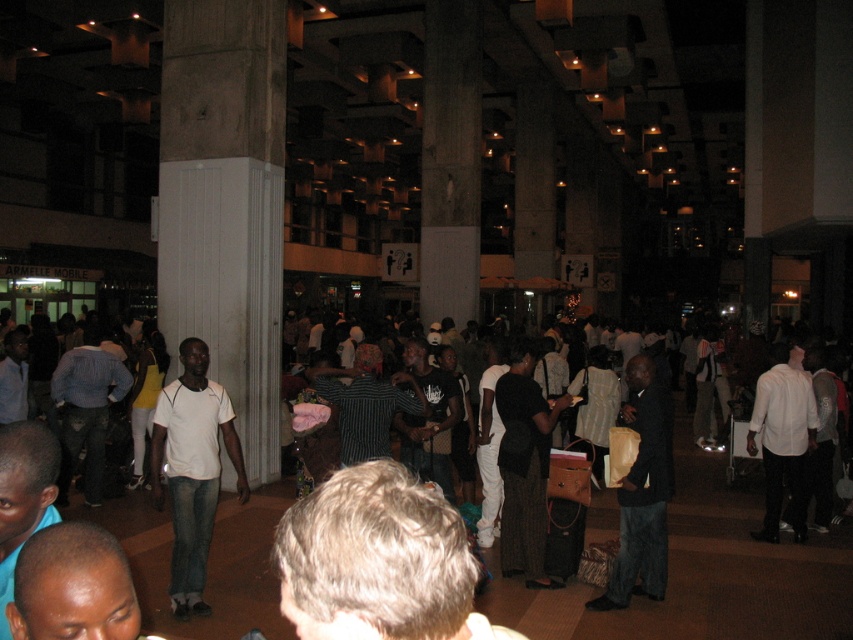
Between white matte t-shirt at center and dark brown leather jacket at center, which one appears on the left side from the viewer's perspective?

white matte t-shirt at center

Which of these two, white matte t-shirt at center or dark brown leather jacket at center, stands taller?

white matte t-shirt at center

Consider the image. Who is more forward, (225, 440) or (653, 532)?

Positioned in front is point (225, 440).

Locate an element on the screen. This screenshot has height=640, width=853. white matte t-shirt at center is located at coordinates (192, 468).

Can you confirm if dark brown leather jacket at center is positioned below white shirt at right?

Actually, dark brown leather jacket at center is above white shirt at right.

Can you confirm if dark brown leather jacket at center is thinner than white shirt at right?

No, dark brown leather jacket at center is not thinner than white shirt at right.

Is point (634, 368) positioned after point (772, 460)?

No, (634, 368) is in front of (772, 460).

Identify the location of dark brown leather jacket at center. point(642,492).

Does white matte t-shirt at center have a greater width compared to white shirt at right?

Yes.

Based on the photo, can you confirm if white matte t-shirt at center is shorter than white shirt at right?

In fact, white matte t-shirt at center may be taller than white shirt at right.

In order to click on white matte t-shirt at center in this screenshot , I will do `click(192, 468)`.